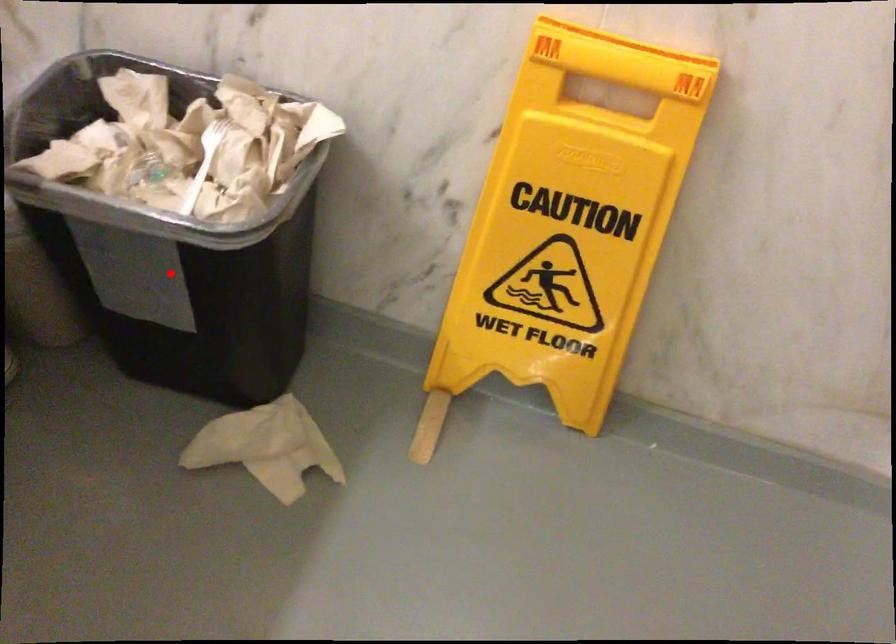
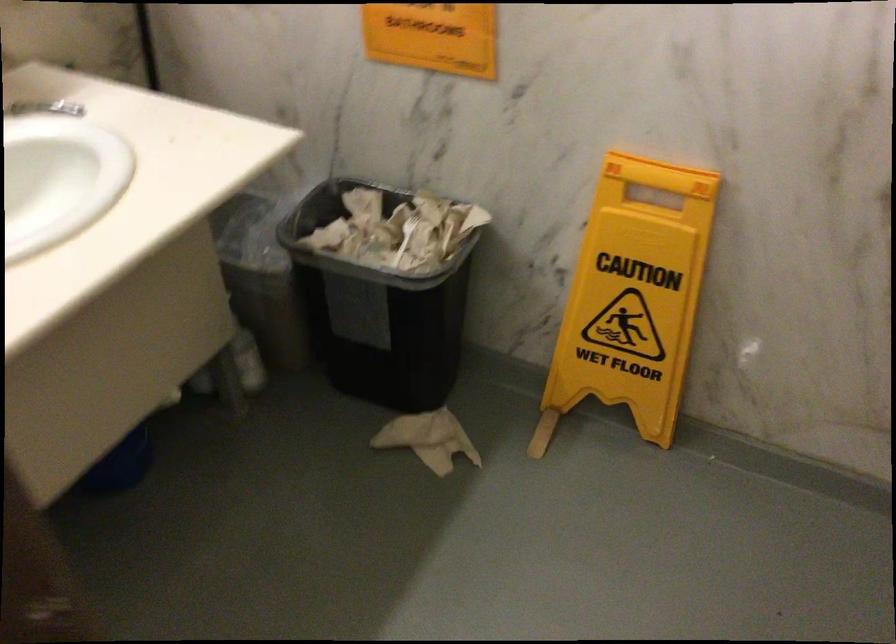
Question: I am providing you with two images of the same scene from different viewpoints. Image1 has a red point marked. In image2, the corresponding 3D location appears at what relative position? Reply with the corresponding letter.

Choices:
 (A) Closer
 (B) Farther

Answer: (B)